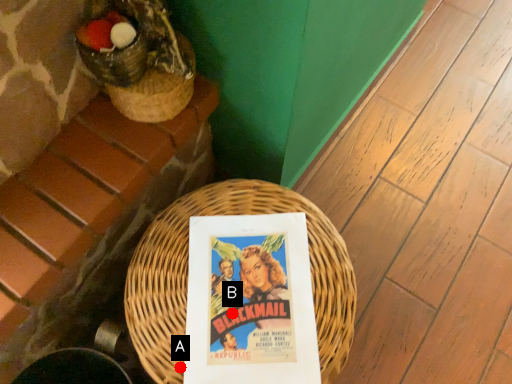
Question: Two points are circled on the image, labeled by A and B beside each circle. Which of the following is the closest to the observer?

Choices:
 (A) A is closer
 (B) B is closer

Answer: (A)